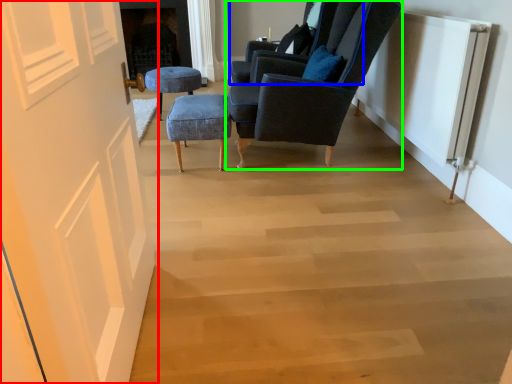
Question: Considering the real-world distances, which object is farthest from door (highlighted by a red box)? chair (highlighted by a blue box) or chair (highlighted by a green box)?

Choices:
 (A) chair
 (B) chair

Answer: (A)